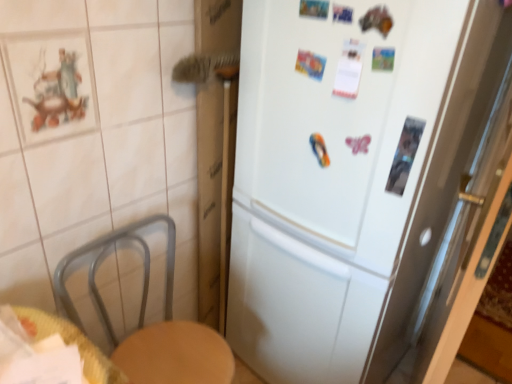
You are a GUI agent. You are given a task and a screenshot of the screen. Output one action in this format:
    pyautogui.click(x=<x>, y=<y>)
    Task: Click on the woven wood table at lower left
    The width and height of the screenshot is (512, 384).
    Given the screenshot: What is the action you would take?
    pyautogui.click(x=70, y=343)

Image resolution: width=512 pixels, height=384 pixels. What do you see at coordinates (70, 343) in the screenshot?
I see `woven wood table at lower left` at bounding box center [70, 343].

Identify the location of white matte refrigerator at center. The height and width of the screenshot is (384, 512). (367, 186).

Describe the element at coordinates (367, 186) in the screenshot. I see `white matte refrigerator at center` at that location.

Where is `woven wood table at lower left`? woven wood table at lower left is located at coordinates (70, 343).

Can you confirm if white matte refrigerator at center is positioned to the left of woven wood table at lower left?

No.

Is white matte refrigerator at center further to the viewer compared to woven wood table at lower left?

Yes.

Which is nearer, (392,59) or (50,319)?

The point (392,59) is closer to the camera.

From the image's perspective, relative to woven wood table at lower left, is white matte refrigerator at center above or below?

white matte refrigerator at center is situated higher than woven wood table at lower left in the image.

From a real-world perspective, is white matte refrigerator at center located beneath woven wood table at lower left?

Yes, from a real-world perspective, white matte refrigerator at center is below woven wood table at lower left.

Considering the sizes of white matte refrigerator at center and woven wood table at lower left in the image, is white matte refrigerator at center wider or thinner than woven wood table at lower left?

In the image, white matte refrigerator at center appears to be wider than woven wood table at lower left.

Considering the relative sizes of white matte refrigerator at center and woven wood table at lower left in the image provided, is white matte refrigerator at center taller than woven wood table at lower left?

Yes, white matte refrigerator at center is taller than woven wood table at lower left.

Consider the image. In terms of size, does white matte refrigerator at center appear bigger or smaller than woven wood table at lower left?

Clearly, white matte refrigerator at center is larger in size than woven wood table at lower left.

Is woven wood table at lower left located within white matte refrigerator at center?

That's incorrect, woven wood table at lower left is not inside white matte refrigerator at center.

Is white matte refrigerator at center with woven wood table at lower left?

No, white matte refrigerator at center is not with woven wood table at lower left.

Is white matte refrigerator at center turned away from woven wood table at lower left?

white matte refrigerator at center does not have its back to woven wood table at lower left.

How different are the orientations of white matte refrigerator at center and woven wood table at lower left in degrees?

The angle between the facing direction of white matte refrigerator at center and the facing direction of woven wood table at lower left is 96 degrees.

How much distance is there between white matte refrigerator at center and woven wood table at lower left?

31.92 inches.

Where is `refrigerator above the woven wood table at lower left (from the image's perspective)`? This screenshot has height=384, width=512. refrigerator above the woven wood table at lower left (from the image's perspective) is located at coordinates (367, 186).

Is woven wood table at lower left to the left or to the right of white matte refrigerator at center in the image?

Based on their positions, woven wood table at lower left is located to the left of white matte refrigerator at center.

Between woven wood table at lower left and white matte refrigerator at center, which one is positioned in front?

woven wood table at lower left is in front.

Which is in front, point (121, 376) or point (472, 7)?

The point (472, 7) is more forward.

From the image's perspective, which is below, woven wood table at lower left or white matte refrigerator at center?

woven wood table at lower left appears lower in the image.

From a real-world perspective, is woven wood table at lower left physically located above or below white matte refrigerator at center?

woven wood table at lower left is above white matte refrigerator at center.

In terms of width, does woven wood table at lower left look wider or thinner when compared to white matte refrigerator at center?

Considering their sizes, woven wood table at lower left looks slimmer than white matte refrigerator at center.

Who is taller, woven wood table at lower left or white matte refrigerator at center?

white matte refrigerator at center is taller.

Between woven wood table at lower left and white matte refrigerator at center, which one has larger size?

Bigger between the two is white matte refrigerator at center.

Is white matte refrigerator at center located within woven wood table at lower left?

Actually, white matte refrigerator at center is outside woven wood table at lower left.

Is woven wood table at lower left positioned far away from white matte refrigerator at center?

woven wood table at lower left is near white matte refrigerator at center, not far away.

Is woven wood table at lower left oriented towards white matte refrigerator at center?

No, woven wood table at lower left is not aimed at white matte refrigerator at center.

How different are the orientations of woven wood table at lower left and white matte refrigerator at center in degrees?

They differ by 96 degrees in their facing directions.

Find the location of a particular element. table above the white matte refrigerator at center (from a real-world perspective) is located at coordinates (70, 343).

Find the location of a particular element. The image size is (512, 384). refrigerator above the woven wood table at lower left (from the image's perspective) is located at coordinates (367, 186).

Identify the location of table below the white matte refrigerator at center (from the image's perspective). The width and height of the screenshot is (512, 384). (70, 343).